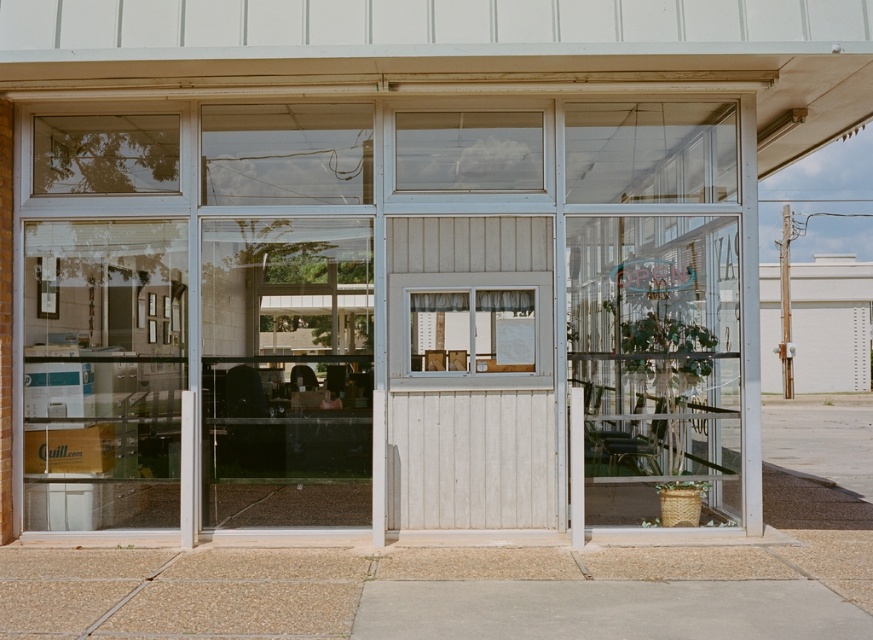
You are a delivery person approaching the storefront. You need to enter the store. Which object should you go through first, the clear glass door at center or the transparent glass window at center?

You should go through the clear glass door at center first because it is closer to you than the transparent glass window at center, which is further away.

You are a delivery person trying to enter the store. The clear glass door at center and the transparent glass window at center are both in front of you. Which one should you go through to enter the store?

You should go through the clear glass door at center to enter the store because it is a door, and doors are typically used for entry, while windows are stationary. Additionally, the clear glass door at center is located below the transparent glass window at center, which suggests it is positioned at the entrance level for accessibility.

You are a delivery person with a box that is 1.5 meters wide. You need to enter the store through either the clear glass door at center or the matte white window at center. Which entrance can you use to fit your box through?

The clear glass door at center and matte white window at center are 1.37 meters apart from each other. Since the box is 1.5 meters wide, it is wider than the 1.37 meter gap between the two entrance points. Therefore, the box cannot fit through either entrance.